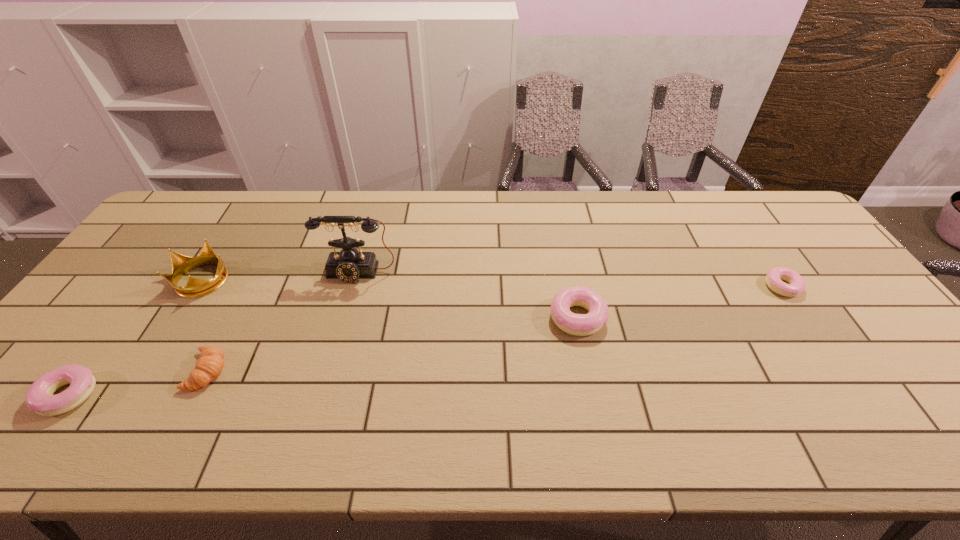
Identify the location of vacant region between the crescent roll and the nearest doughnut. This screenshot has width=960, height=540. (138, 383).

Image resolution: width=960 pixels, height=540 pixels. In order to click on vacant space in between the crescent roll and the shortest doughnut in this screenshot , I will do `click(495, 329)`.

Identify the location of free point between the shortest doughnut and the second shortest doughnut. This screenshot has width=960, height=540. (425, 341).

Where is `empty space between the leftmost object and the fourth shortest object`? The width and height of the screenshot is (960, 540). empty space between the leftmost object and the fourth shortest object is located at coordinates (323, 356).

Where is `free space between the fourth object from right to left and the tallest object`? free space between the fourth object from right to left and the tallest object is located at coordinates (283, 322).

In order to click on object that ranks as the third closest to the crescent roll in this screenshot , I will do `click(348, 265)`.

I want to click on object that stands as the fourth closest to the tallest doughnut, so click(x=181, y=264).

This screenshot has height=540, width=960. I want to click on doughnut that is the third closest to the crescent roll, so click(774, 277).

Identify which doughnut is located as the third nearest to the fourth object from right to left. Please provide its 2D coordinates. Your answer should be formatted as a tuple, i.e. [(x, y)], where the tuple contains the x and y coordinates of a point satisfying the conditions above.

[(774, 277)]

Identify the location of blank area in the image that satisfies the following two spatial constraints: 1. on the dial of the fourth shortest object; 2. on the left side of the telephone. The width and height of the screenshot is (960, 540). (346, 318).